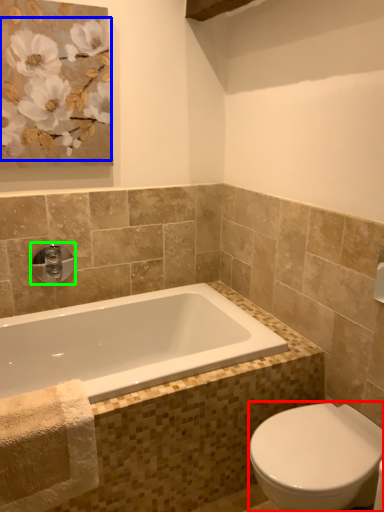
Question: Considering the real-world distances, which object is farthest from bidet (highlighted by a red box)? flower (highlighted by a blue box) or tap (highlighted by a green box)?

Choices:
 (A) flower
 (B) tap

Answer: (A)